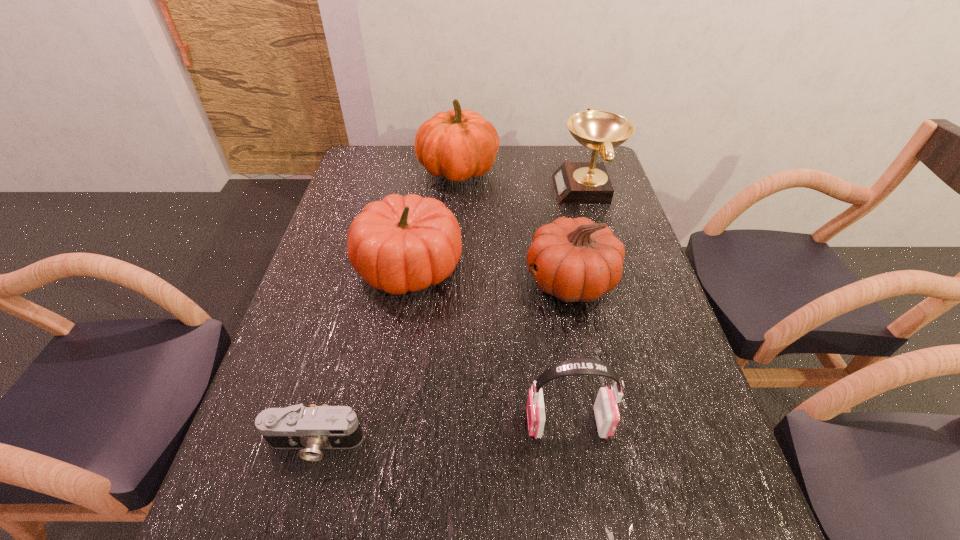
This screenshot has width=960, height=540. Find the location of `vacant region that satisfies the following two spatial constraints: 1. on the front-facing side of the award; 2. on the lens of the camera`. vacant region that satisfies the following two spatial constraints: 1. on the front-facing side of the award; 2. on the lens of the camera is located at coordinates (662, 443).

This screenshot has width=960, height=540. Find the location of `vacant space that satisfies the following two spatial constraints: 1. on the front-facing side of the award; 2. on the lens of the camera`. vacant space that satisfies the following two spatial constraints: 1. on the front-facing side of the award; 2. on the lens of the camera is located at coordinates (662, 443).